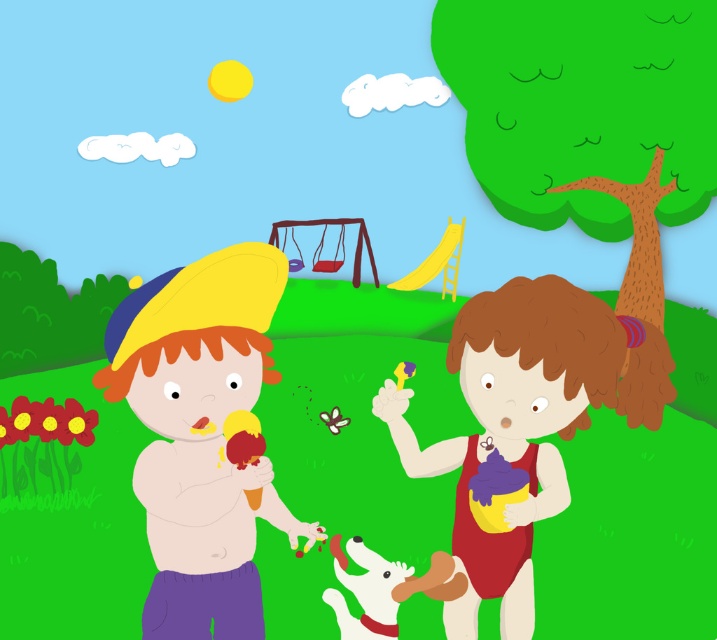
Question: Can you confirm if smooth yellow hat at left is positioned above matte yellow swimsuit at center?

Choices:
 (A) yes
 (B) no

Answer: (A)

Question: Which object appears closest to the camera in this image?

Choices:
 (A) matte yellow swimsuit at center
 (B) smooth yellow hat at left

Answer: (B)

Question: Does smooth yellow hat at left lie behind matte yellow swimsuit at center?

Choices:
 (A) yes
 (B) no

Answer: (B)

Question: Is smooth yellow hat at left positioned in front of matte yellow swimsuit at center?

Choices:
 (A) no
 (B) yes

Answer: (B)